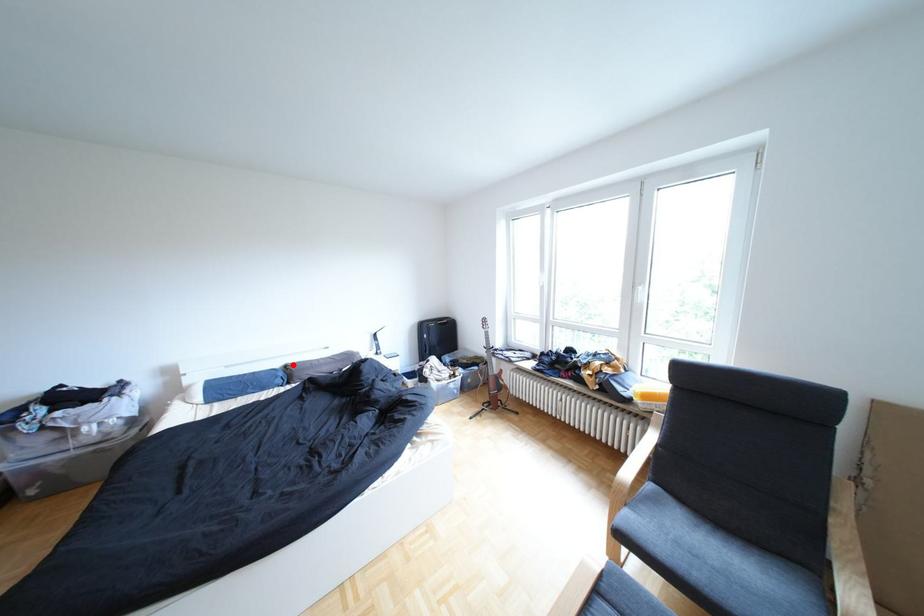
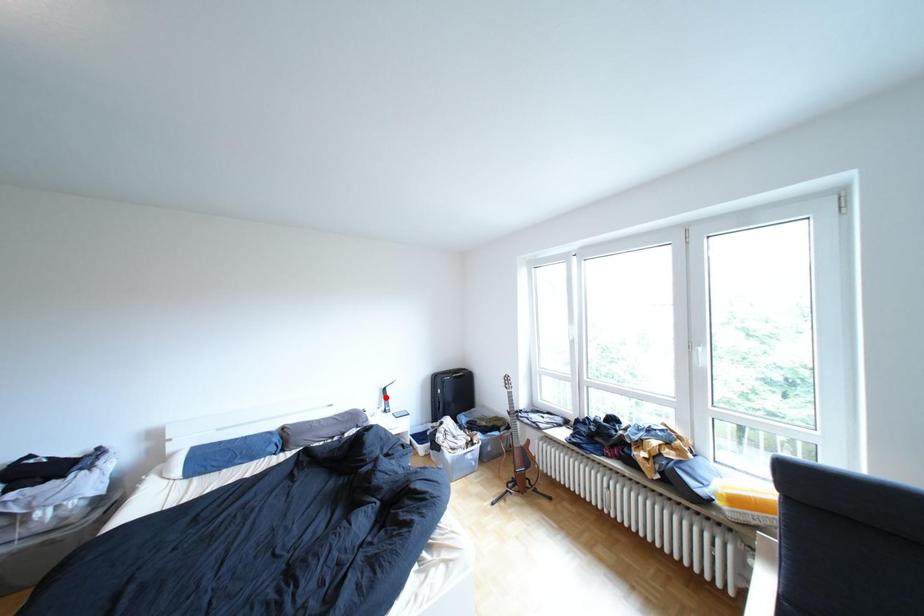
I am providing you with two images of the same scene from different viewpoints. A red point is marked on the first image and another point is marked on the second image. Is the red point in image1 aligned with the point shown in image2?

No